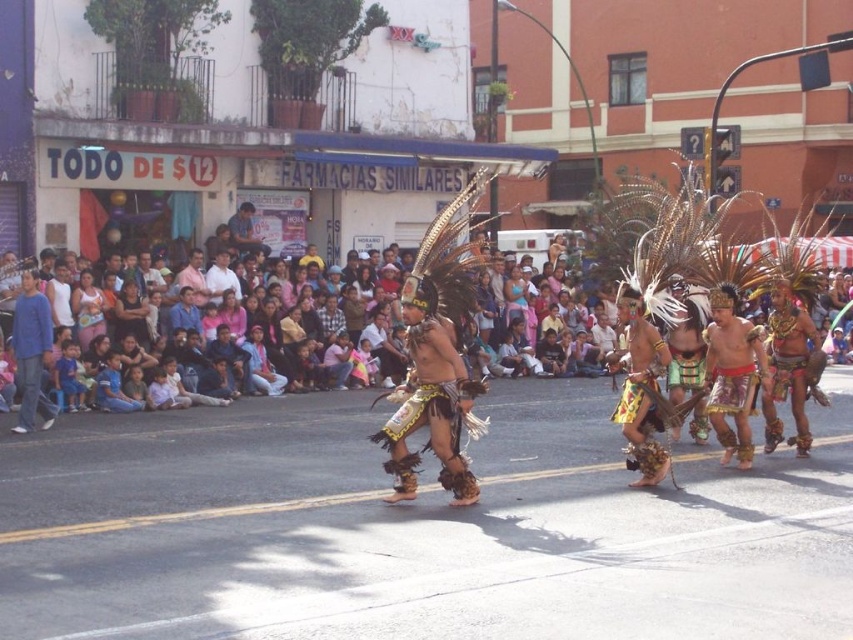
You are standing in the middle of the parade street. You see two points marked on the ground ahead of you. The first point is at coordinate point (45, 360) and the second point is at coordinate point (248, 212). Which point is closer to you?

Point (45, 360) is closer to the viewer than point (248, 212).

You are a photographer at the parade and want to capture both the blue cotton shirt at left and the matte black shirt at center in a single shot. Which shirt should you position closer to the left edge of your camera frame to ensure both are visible?

The blue cotton shirt at left should be positioned closer to the left edge of your camera frame because it is already on the left side of the matte black shirt at center, ensuring both are visible in the shot.

You are a photographer standing on the street. You want to capture a photo that includes both the blue cotton shirt at left and the matte skin people at center. Based on their positions, which object should you focus on first to ensure both are in the frame?

The blue cotton shirt at left is above matte skin people at center, so you should focus on the blue cotton shirt at left first to ensure both are in the frame.